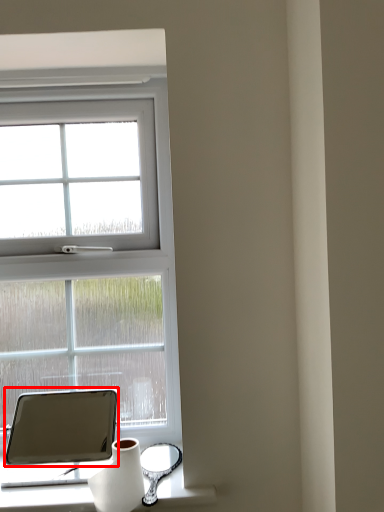
Question: Observing the image, what is the correct spatial positioning of tablet computer (annotated by the red box) in reference to vase?

Choices:
 (A) left
 (B) right

Answer: (A)